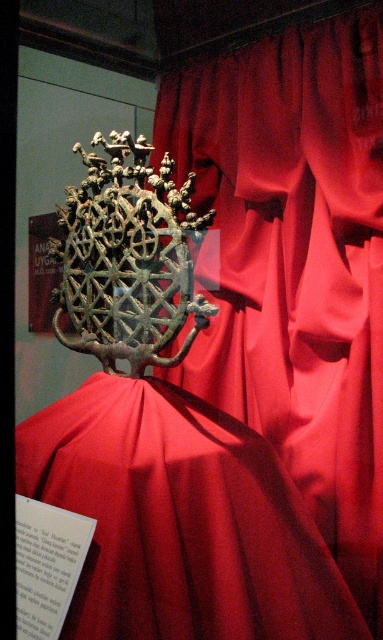
You are an interior designer planning to place a new lamp on the display. The lamp requires a flat surface. Which object between the satin red curtain at center and the satin red dress at center would be more suitable for placing the lamp?

The satin red dress at center is located below the satin red curtain at center, so the dress might have a flatter surface compared to the curtain which is hanging. Therefore, the lamp should be placed on the satin red dress at center.

You are a photographer setting up a shoot in this museum. You have two items in front of you, the satin red curtain at center and the satin red dress at center. Which one do you need to adjust your camera focus on first if you want to capture both in sharp detail?

The satin red curtain at center is larger than the satin red dress at center, so you should focus on the larger item first to ensure proper depth of field for both.

You are a museum curator arranging an exhibit. You have two items to place on a display table. The items are the satin red curtain at center and the satin red dress at center. According to the description, how should you position them to match the original arrangement?

The satin red curtain at center should be placed to the right of the satin red dress at center to match the original arrangement.